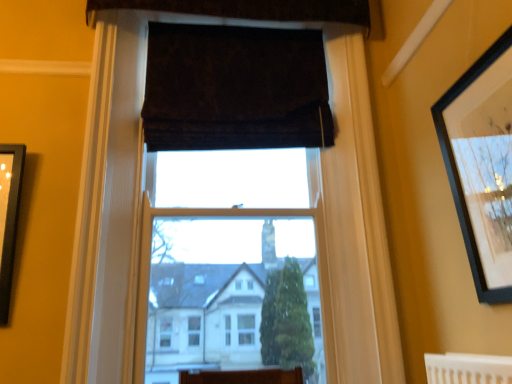
Question: Does dark velvet curtain at upper center, which ranks as the 2th curtain in top-to-bottom order, have a greater width compared to black matte picture frame at upper right?

Choices:
 (A) yes
 (B) no

Answer: (A)

Question: Is black matte picture frame at upper right surrounded by dark velvet curtain at upper center, the first curtain in the bottom-to-top sequence?

Choices:
 (A) no
 (B) yes

Answer: (A)

Question: Does dark velvet curtain at upper center, the first curtain in the bottom-to-top sequence, have a lesser height compared to black matte picture frame at upper right?

Choices:
 (A) no
 (B) yes

Answer: (B)

Question: From the image's perspective, is dark velvet curtain at upper center, the first curtain in the bottom-to-top sequence, on black matte picture frame at upper right?

Choices:
 (A) yes
 (B) no

Answer: (A)

Question: Is dark velvet curtain at upper center, which ranks as the 2th curtain in top-to-bottom order, next to black matte picture frame at upper right and touching it?

Choices:
 (A) yes
 (B) no

Answer: (B)

Question: Can you confirm if dark velvet curtain at upper center, the first curtain in the bottom-to-top sequence, is positioned to the left of black matte picture frame at upper right?

Choices:
 (A) yes
 (B) no

Answer: (A)

Question: Is dark brown velvet curtain at upper center, which appears as the 1th curtain when viewed from the top, thinner than black matte picture frame at upper right?

Choices:
 (A) no
 (B) yes

Answer: (A)

Question: Considering the relative sizes of dark brown velvet curtain at upper center, which appears as the 1th curtain when viewed from the top, and black matte picture frame at upper right in the image provided, is dark brown velvet curtain at upper center, which appears as the 1th curtain when viewed from the top, shorter than black matte picture frame at upper right?

Choices:
 (A) yes
 (B) no

Answer: (A)

Question: Would you consider dark brown velvet curtain at upper center, which appears as the 1th curtain when viewed from the top, to be distant from black matte picture frame at upper right?

Choices:
 (A) yes
 (B) no

Answer: (A)

Question: Is the depth of dark brown velvet curtain at upper center, which appears as the 1th curtain when viewed from the top, greater than that of black matte picture frame at upper right?

Choices:
 (A) no
 (B) yes

Answer: (B)

Question: Does dark brown velvet curtain at upper center, which appears as the second curtain when ordered from the bottom, have a larger size compared to black matte picture frame at upper right?

Choices:
 (A) yes
 (B) no

Answer: (A)

Question: Is dark brown velvet curtain at upper center, which appears as the second curtain when ordered from the bottom, positioned beyond the bounds of black matte picture frame at upper right?

Choices:
 (A) no
 (B) yes

Answer: (B)

Question: Considering the relative sizes of black matte picture frame at upper right and dark velvet curtain at upper center, which ranks as the 2th curtain in top-to-bottom order, in the image provided, is black matte picture frame at upper right smaller than dark velvet curtain at upper center, which ranks as the 2th curtain in top-to-bottom order,?

Choices:
 (A) no
 (B) yes

Answer: (B)